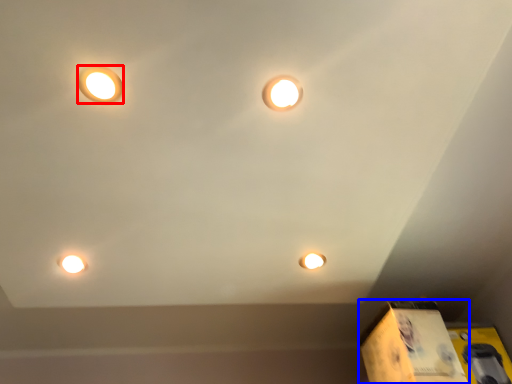
Question: Which point is further to the camera, lamp (highlighted by a red box) or cardboard box (highlighted by a blue box)?

Choices:
 (A) lamp
 (B) cardboard box

Answer: (B)